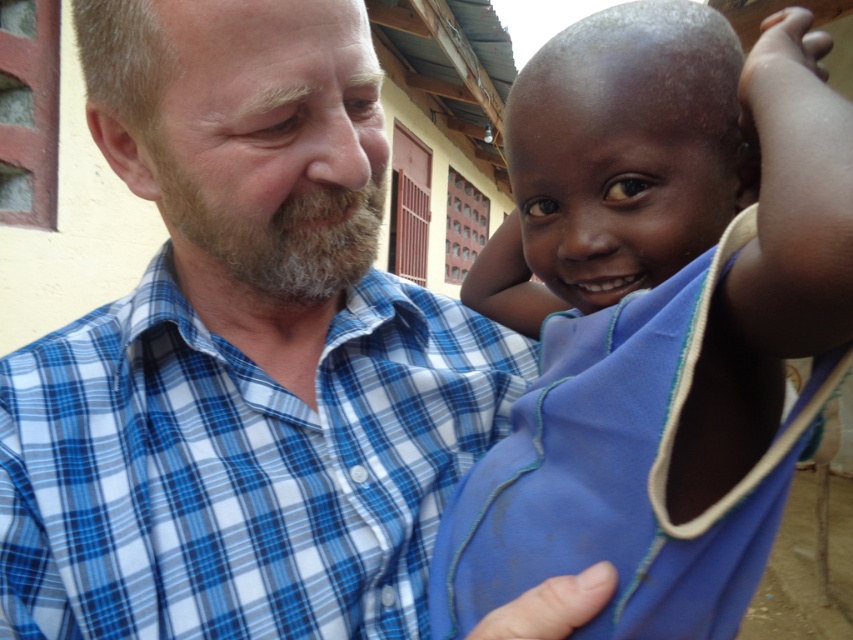
Question: Which of the following is the closest to the observer?

Choices:
 (A) blue fabric at right
 (B) blue plaid shirt at center

Answer: (A)

Question: Is blue fabric at right further to the viewer compared to blue plaid shirt at center?

Choices:
 (A) yes
 (B) no

Answer: (B)

Question: Which point appears closest to the camera in this image?

Choices:
 (A) (689, 346)
 (B) (64, 433)

Answer: (A)

Question: Does blue fabric at right have a lesser width compared to blue plaid shirt at center?

Choices:
 (A) no
 (B) yes

Answer: (B)

Question: Is blue fabric at right to the right of blue plaid shirt at center from the viewer's perspective?

Choices:
 (A) no
 (B) yes

Answer: (B)